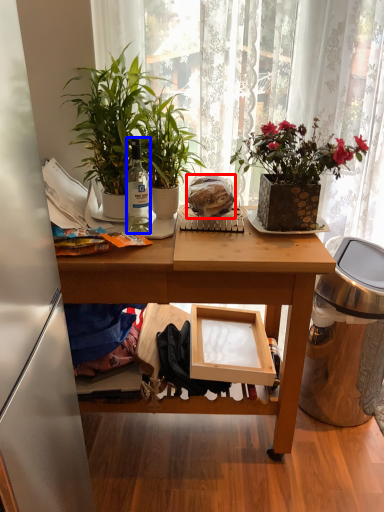
Question: Which object is further to the camera taking this photo, food (highlighted by a red box) or bottle (highlighted by a blue box)?

Choices:
 (A) food
 (B) bottle

Answer: (A)